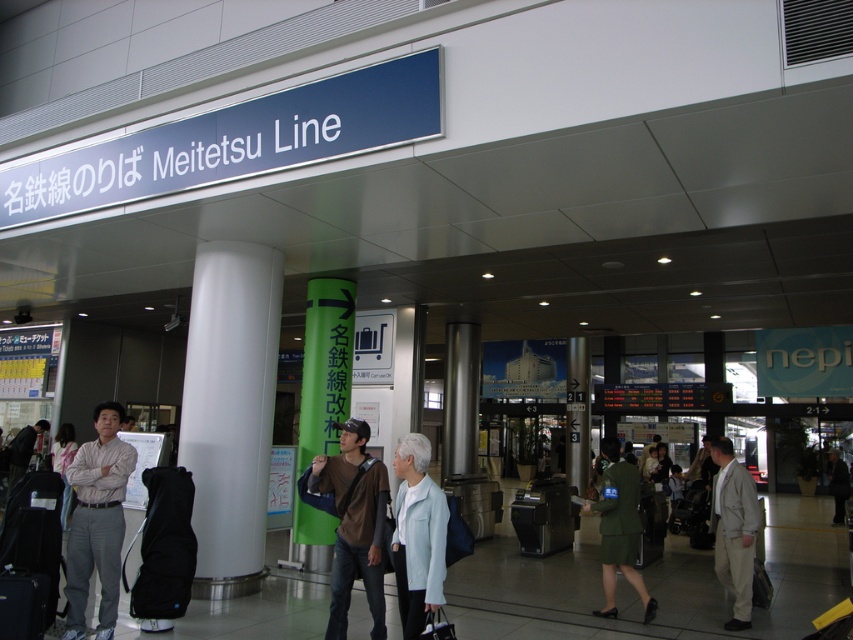
Question: Which of the following is the closest to the observer?

Choices:
 (A) white glossy pillar at center
 (B) light brown fabric pants at center
 (C) dark brown leather jacket at left
 (D) brown cotton shirt at center

Answer: (D)

Question: Among these points, which one is nearest to the camera?

Choices:
 (A) (334, 291)
 (B) (181, 577)
 (C) (25, 481)
 (D) (625, 524)

Answer: (C)

Question: Is white glossy pillar at center to the right of green matte pillar at center from the viewer's perspective?

Choices:
 (A) no
 (B) yes

Answer: (A)

Question: Which point is closer to the camera taking this photo?

Choices:
 (A) [x=97, y=422]
 (B) [x=158, y=500]
 (C) [x=610, y=481]
 (D) [x=312, y=333]

Answer: (A)

Question: Is light beige suit at right above black fabric suitcase at lower left?

Choices:
 (A) no
 (B) yes

Answer: (A)

Question: Is light brown fabric pants at center below light beige suit at right?

Choices:
 (A) yes
 (B) no

Answer: (B)